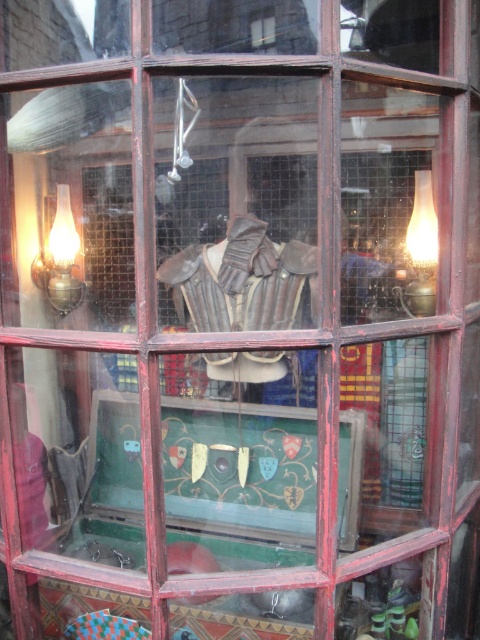
In the scene shown: Is matte brass lamp at left positioned at the back of matte glass lamp at right?

Yes.

In the scene shown: Is matte brass lamp at left shorter than matte glass lamp at right?

Yes, matte brass lamp at left is shorter than matte glass lamp at right.

Between point (35, 269) and point (429, 241), which one is positioned behind?

The point (35, 269) is behind.

The width and height of the screenshot is (480, 640). I want to click on matte brass lamp at left, so click(x=60, y=259).